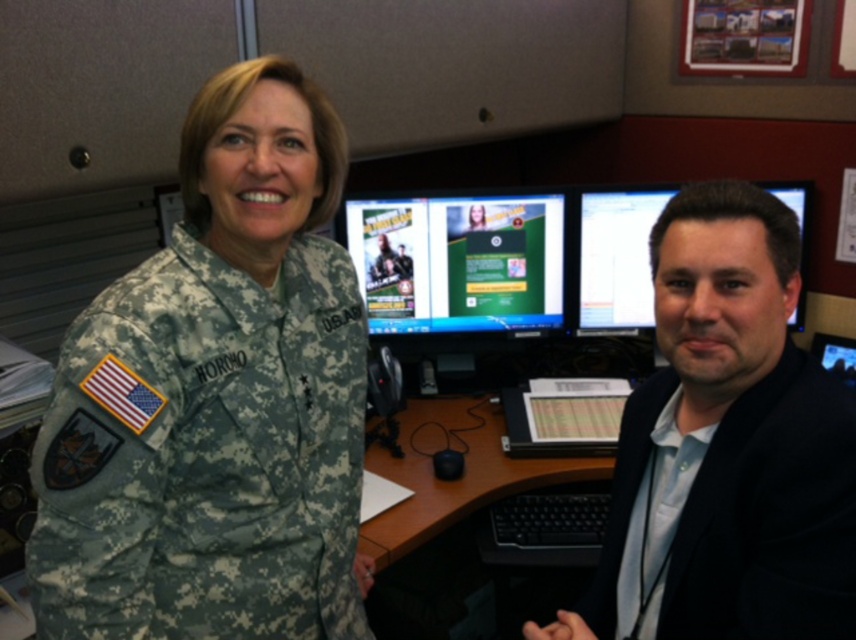
You are an office assistant who needs to adjust the height of the matte black monitor at right so that the camouflage uniform at center can see it comfortably. Based on their current positions, should you raise or lower the monitor?

The camouflage uniform at center is positioned under the matte black monitor at right, so to ensure comfortable viewing, the monitor should be lowered so that its screen is at eye level for the person in the camouflage uniform at center.

You are organizing a group photo and need to arrange two people based on their clothing thickness. The camouflage uniform at center and the black smooth suit at right are the two outfits. Which person should stand closer to the front to ensure their clothing doesn

The camouflage uniform at center is thinner than the black smooth suit at right, so the person wearing the camouflage uniform at center should stand closer to the front to ensure their clothing is visible in the photo.

You are standing in an office and see two people. One is in a U.S. Army uniform on the left, and the other is wearing a dark suit jacket at the right. There is a point marked at coordinate [726,448]. Which object does this coordinate correspond to?

The coordinate [726,448] corresponds to the black smooth suit at right.